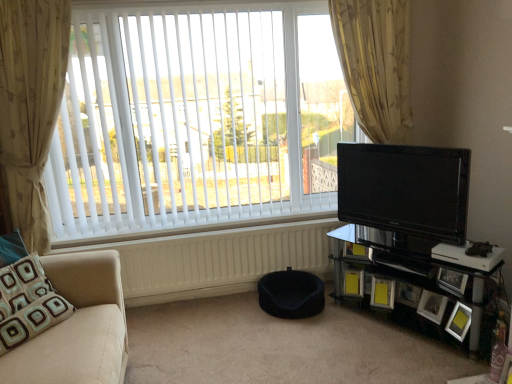
Where is `free space in front of yellow matte picture frame at lower right, which is the 6th picture frame from right to left`? free space in front of yellow matte picture frame at lower right, which is the 6th picture frame from right to left is located at coordinates (362, 306).